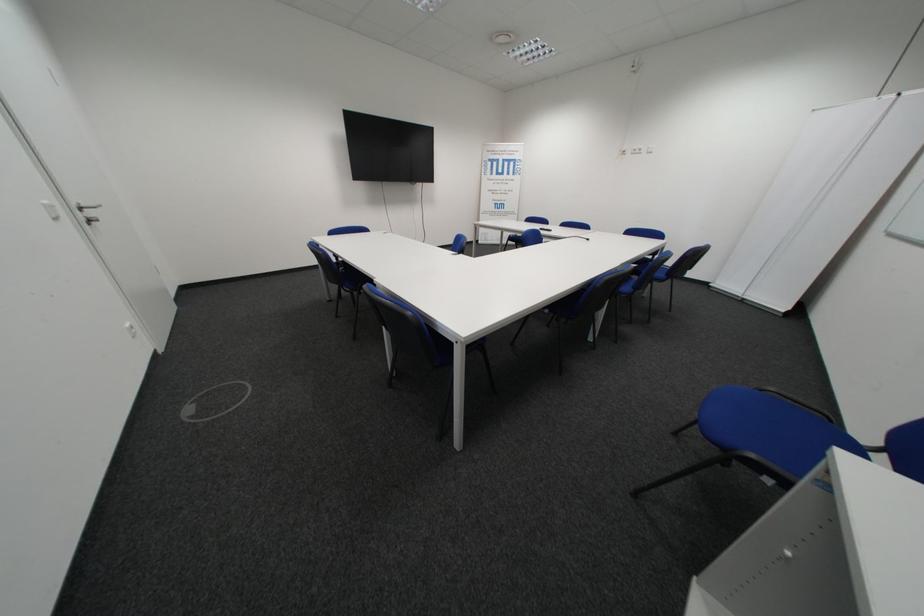
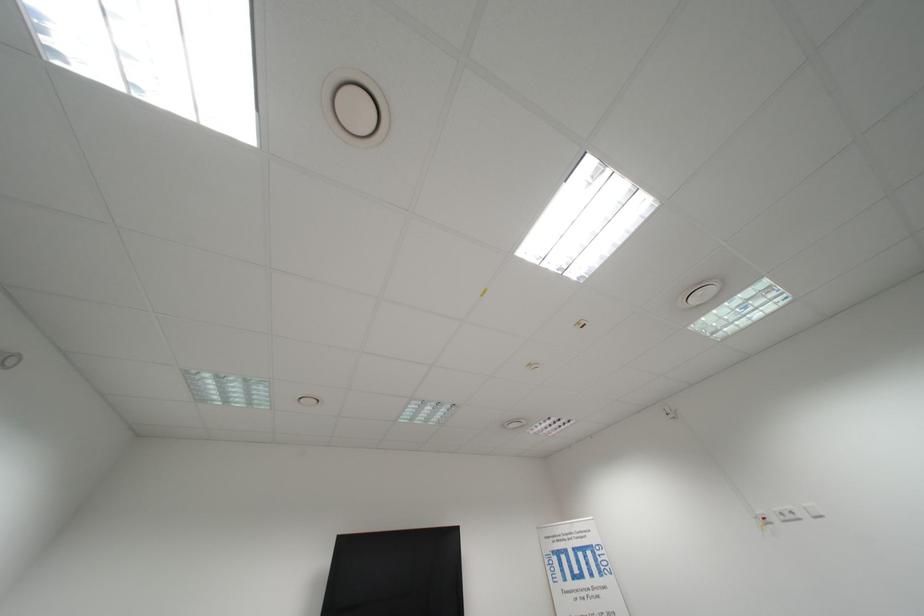
The point at (646, 153) is marked in the first image. Where is the corresponding point in the second image?

(796, 519)